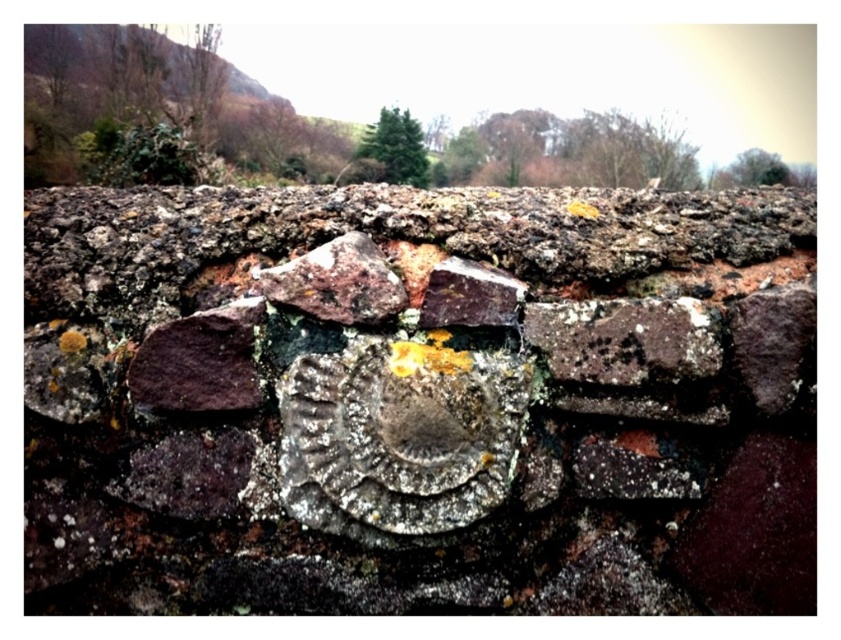
Can you confirm if rusty stone plaque at center is taller than purple stone at left?

Indeed, rusty stone plaque at center has a greater height compared to purple stone at left.

Is point (701, 244) farther from camera compared to point (175, 394)?

Yes, point (701, 244) is behind point (175, 394).

Identify the location of rusty stone plaque at center. (419, 401).